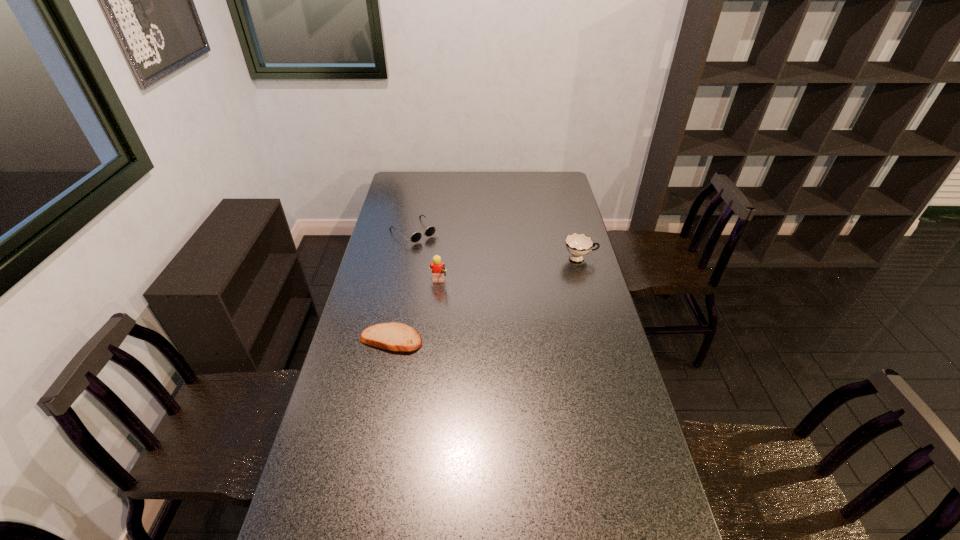
Locate an element on the screen. This screenshot has height=540, width=960. vacant area situated in front of the tallest object with the accessory visible is located at coordinates (489, 285).

Where is `vacant region located in front of the tallest object with the accessory visible`? The height and width of the screenshot is (540, 960). vacant region located in front of the tallest object with the accessory visible is located at coordinates (492, 285).

This screenshot has width=960, height=540. I want to click on free space located on the front-facing side of the third tallest object, so click(x=442, y=255).

Locate an element on the screen. free spot located 0.110m on the front-facing side of the third tallest object is located at coordinates (442, 255).

In order to click on free space located on the front-facing side of the third tallest object in this screenshot , I will do `click(465, 276)`.

Where is `pita bread situated at the left edge`? Image resolution: width=960 pixels, height=540 pixels. pita bread situated at the left edge is located at coordinates (393, 336).

Where is `sunglasses at the left edge`? sunglasses at the left edge is located at coordinates (429, 231).

You are a GUI agent. You are given a task and a screenshot of the screen. Output one action in this format:
    pyautogui.click(x=<x>, y=<y>)
    Task: Click on the object situated at the right edge
    The width and height of the screenshot is (960, 540).
    Given the screenshot: What is the action you would take?
    pyautogui.click(x=578, y=245)

Locate an element on the screen. The width and height of the screenshot is (960, 540). vacant space at the far edge of the desktop is located at coordinates (503, 174).

At what (x,y) coordinates should I click in order to perform the action: click on vacant region at the left edge. Please return your answer as a coordinate pair (x, y). The width and height of the screenshot is (960, 540). Looking at the image, I should click on (376, 355).